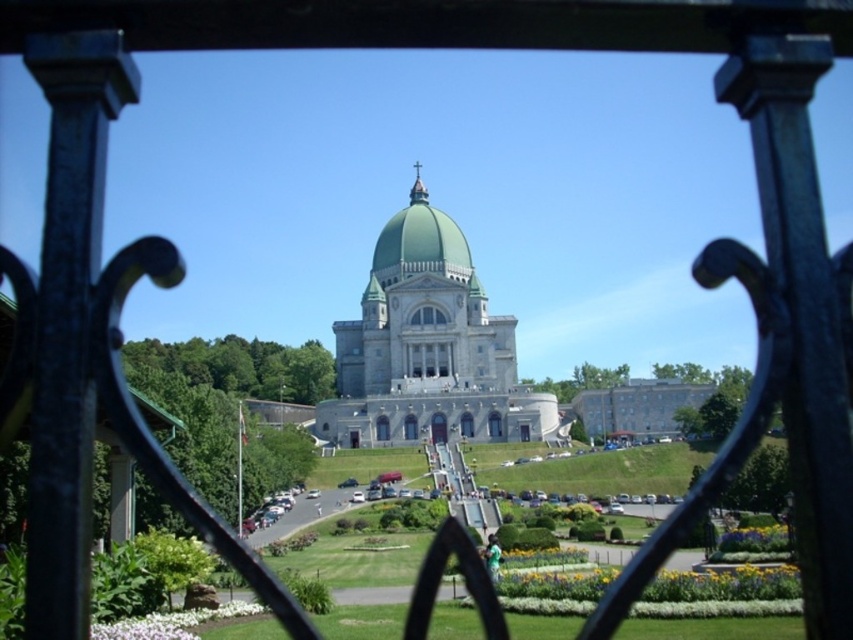
Question: Can you confirm if green marble palace at center is wider than green matte dome at center?

Choices:
 (A) no
 (B) yes

Answer: (B)

Question: Where is green marble palace at center located in relation to green matte dome at center in the image?

Choices:
 (A) right
 (B) left

Answer: (A)

Question: Which point is farther from the camera taking this photo?

Choices:
 (A) (426, 216)
 (B) (482, 429)

Answer: (A)

Question: Does green marble palace at center appear under green matte dome at center?

Choices:
 (A) no
 (B) yes

Answer: (B)